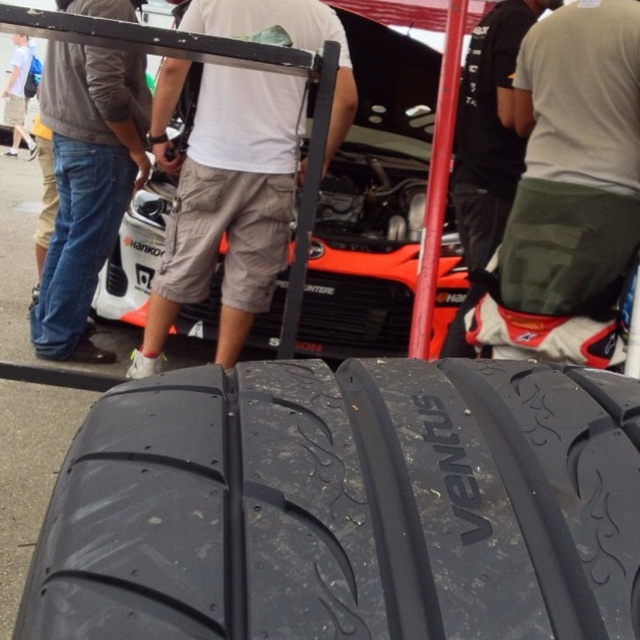
Who is positioned more to the right, black rubber tire at lower center or matte khaki shorts at center?

Positioned to the right is black rubber tire at lower center.

Is black rubber tire at lower center further to the viewer compared to matte khaki shorts at center?

No.

Describe the element at coordinates (346, 506) in the screenshot. I see `black rubber tire at lower center` at that location.

You are a GUI agent. You are given a task and a screenshot of the screen. Output one action in this format:
    pyautogui.click(x=<x>, y=<y>)
    Task: Click on the black rubber tire at lower center
    
    Given the screenshot: What is the action you would take?
    pyautogui.click(x=346, y=506)

From the picture: Can you confirm if black rubber tire at lower center is smaller than white cotton shirt at upper center?

Yes.

Who is more distant from viewer, (61, 516) or (8, 100)?

The point (8, 100) is behind.

Find the location of `black rubber tire at lower center`. black rubber tire at lower center is located at coordinates (346, 506).

Is matte khaki shorts at center to the right of denim jeans at left from the viewer's perspective?

Yes, matte khaki shorts at center is to the right of denim jeans at left.

Who is positioned more to the left, matte khaki shorts at center or denim jeans at left?

Positioned to the left is denim jeans at left.

Locate an element on the screen. The width and height of the screenshot is (640, 640). matte khaki shorts at center is located at coordinates (228, 205).

At what (x,y) coordinates should I click in order to perform the action: click on matte khaki shorts at center. Please return your answer as a coordinate pair (x, y). The width and height of the screenshot is (640, 640). Looking at the image, I should click on (228, 205).